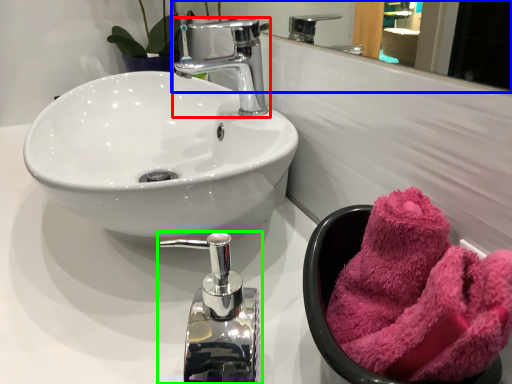
Question: Estimate the real-world distances between objects in this image. Which object is farther from tap (highlighted by a red box), mirror (highlighted by a blue box) or tap (highlighted by a green box)?

Choices:
 (A) mirror
 (B) tap

Answer: (A)